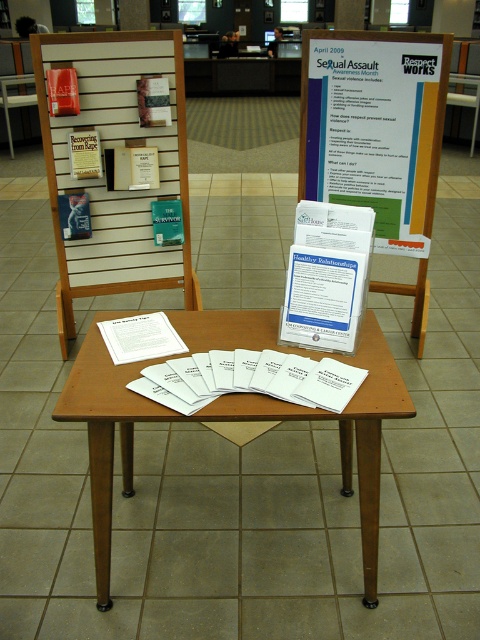
You are a visitor at the library and want to read the white paper poster at center. Where should you look to find it?

The white paper poster at center is located at point (x=373, y=132), so you should look towards that coordinate to find it.

You are organizing a workshop and need to decide where to place a new banner. The banner is the same size as the white paper poster at center. Will it fit in the space currently occupied by the wooden chair at left?

The white paper poster at center is smaller than the wooden chair at left, so the banner, being the same size as the white paper poster at center, will not fit in the space currently occupied by the wooden chair at left since the chair is larger.

You are organizing a workshop and need to place a 2ft wide box on the brown wooden table at center. The white paper poster at center is currently placed to the right of the table. Can the box fit on the table without overlapping the poster?

The brown wooden table at center might be wider than the white paper poster at center, so there is a possibility that the 2ft wide box can fit on the table without overlapping the poster. However, the exact dimensions are uncertain based on the given information.